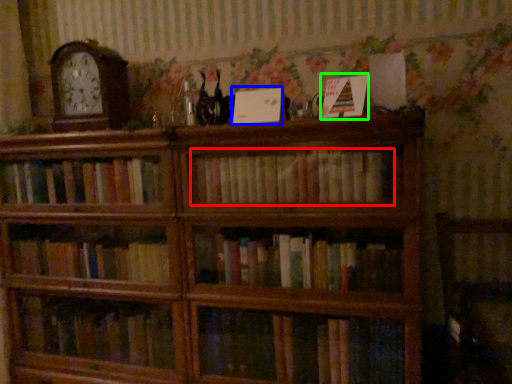
Question: Which object is positioned farthest from book (highlighted by a red box)? Select from paperback book (highlighted by a blue box) and paperback book (highlighted by a green box).

Choices:
 (A) paperback book
 (B) paperback book

Answer: (B)